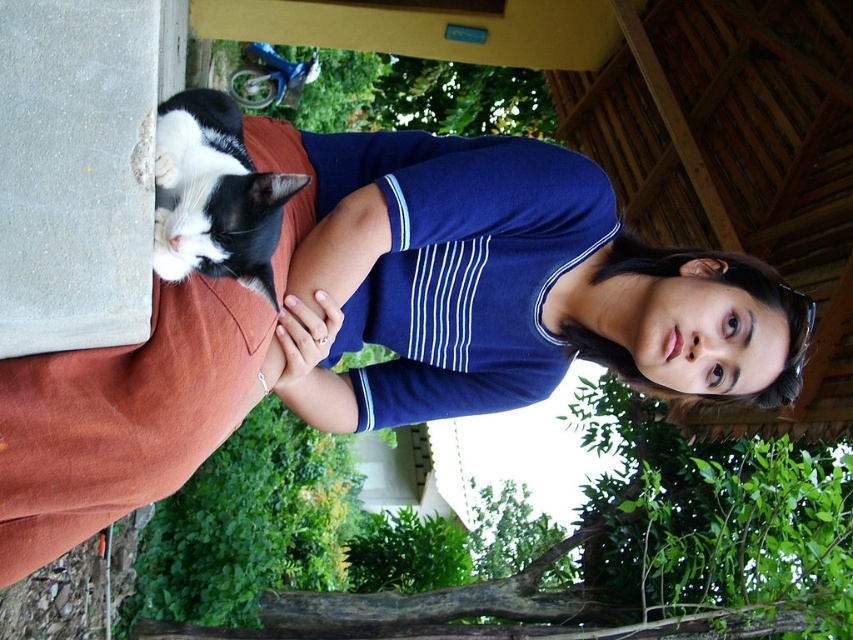
Question: Is matte blue shirt at center positioned at the back of black and white fur cat at upper left?

Choices:
 (A) yes
 (B) no

Answer: (A)

Question: Can you confirm if matte blue shirt at center is positioned to the right of black and white fur cat at upper left?

Choices:
 (A) no
 (B) yes

Answer: (B)

Question: Does matte blue shirt at center have a smaller size compared to black and white fur cat at upper left?

Choices:
 (A) yes
 (B) no

Answer: (B)

Question: Among these points, which one is farthest from the camera?

Choices:
 (A) (677, 342)
 (B) (196, 179)

Answer: (A)

Question: Which object appears farthest from the camera in this image?

Choices:
 (A) matte blue shirt at center
 (B) black and white fur cat at upper left

Answer: (A)

Question: Which point is farther to the camera?

Choices:
 (A) (778, 381)
 (B) (302, 182)

Answer: (A)